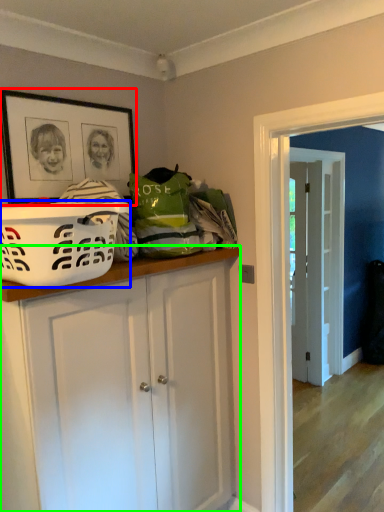
Question: Which object is the closest to the picture frame (highlighted by a red box)? Choose among these: basket (highlighted by a blue box) or cabinetry (highlighted by a green box).

Choices:
 (A) basket
 (B) cabinetry

Answer: (A)